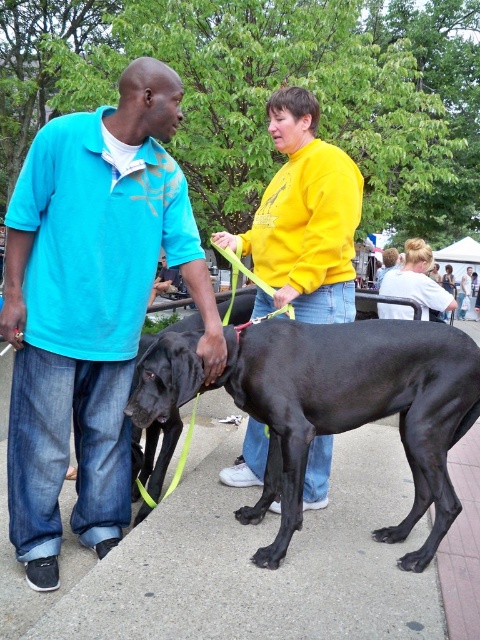
Question: Is black smooth dog at center closer to the viewer compared to yellow matte shirt at center?

Choices:
 (A) yes
 (B) no

Answer: (A)

Question: Which object is farther from the camera taking this photo?

Choices:
 (A) light blue denim jeans at center
 (B) matte blue shirt at center
 (C) black smooth dog at center
 (D) yellow matte shirt at center

Answer: (A)

Question: Is matte blue shirt at center in front of light blue denim jeans at center?

Choices:
 (A) no
 (B) yes

Answer: (B)

Question: Which point is farther to the camera?

Choices:
 (A) (408, 307)
 (B) (134, 80)
 (C) (297, 209)

Answer: (A)

Question: From the image, what is the correct spatial relationship of matte blue shirt at center in relation to yellow matte shirt at center?

Choices:
 (A) above
 (B) below

Answer: (B)

Question: Which object is the farthest from the black smooth dog at center?

Choices:
 (A) yellow matte shirt at center
 (B) light blue denim jeans at center
 (C) matte blue shirt at center

Answer: (B)